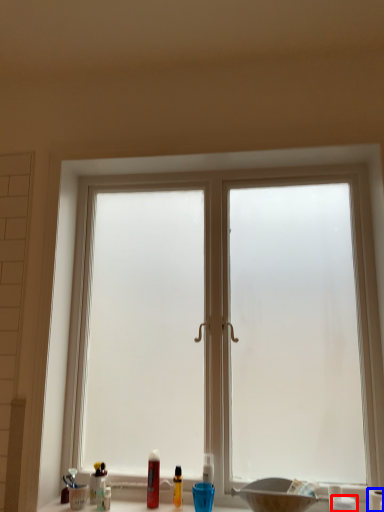
Question: Which object appears farthest to the camera in this image, toiletry (highlighted by a red box) or toilet paper (highlighted by a blue box)?

Choices:
 (A) toiletry
 (B) toilet paper

Answer: (B)